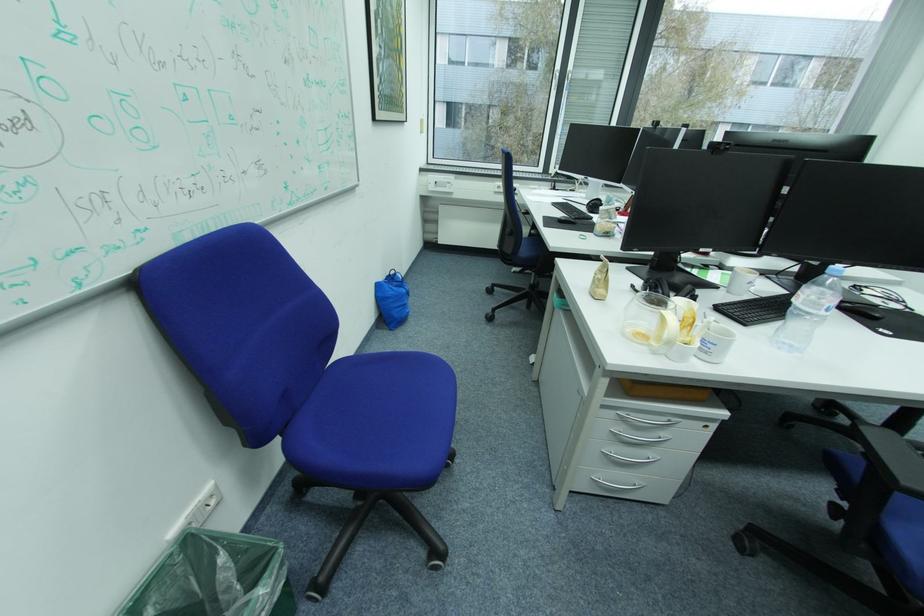
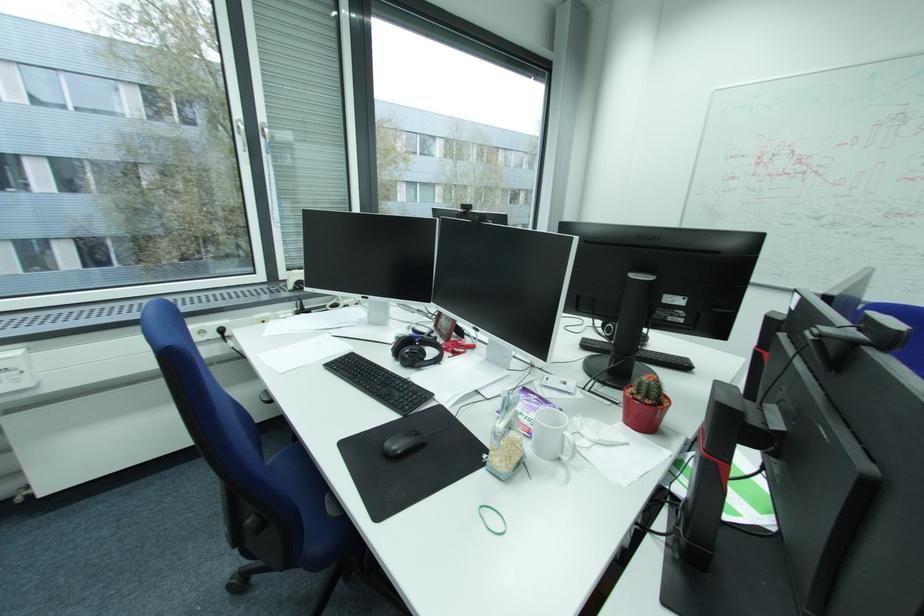
Find the pixel in the second image that matches point (565, 71) in the first image.

(247, 121)